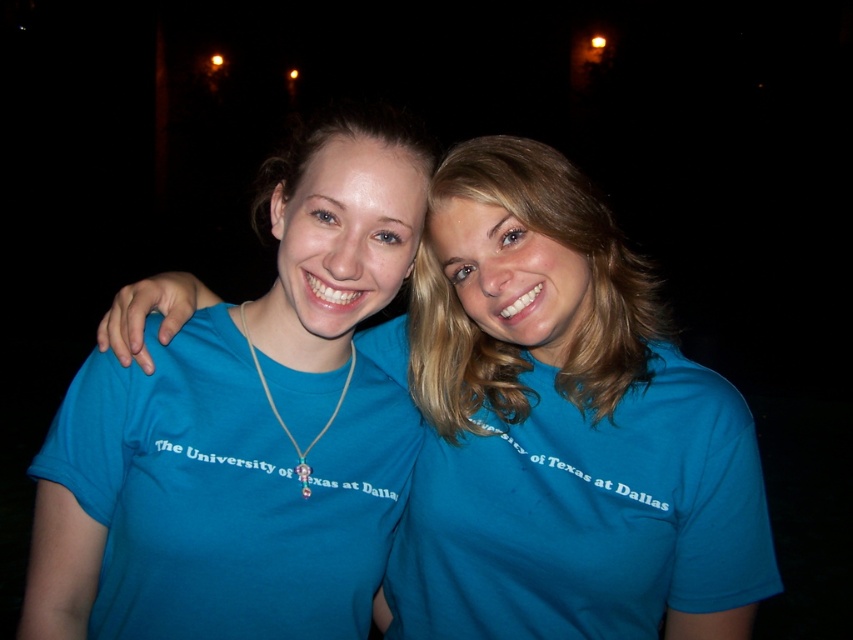
Between blue fabric shirt at center and blue cotton shirt at center, which one is positioned higher?

Positioned higher is blue cotton shirt at center.

Is blue fabric shirt at center positioned before blue cotton shirt at center?

Yes, it is in front of blue cotton shirt at center.

Describe the element at coordinates (561, 428) in the screenshot. This screenshot has width=853, height=640. I see `blue fabric shirt at center` at that location.

What are the coordinates of `blue fabric shirt at center` in the screenshot? It's located at (561, 428).

Between blue cotton shirt at center and gold chain with beads at center, which one has less height?

With less height is gold chain with beads at center.

Between blue cotton shirt at center and gold chain with beads at center, which one appears on the left side from the viewer's perspective?

From the viewer's perspective, gold chain with beads at center appears more on the left side.

Locate an element on the screen. This screenshot has width=853, height=640. blue cotton shirt at center is located at coordinates (517, 340).

Identify the location of matte blue t-shirt at center. Image resolution: width=853 pixels, height=640 pixels. (244, 432).

Image resolution: width=853 pixels, height=640 pixels. I want to click on matte blue t-shirt at center, so click(x=244, y=432).